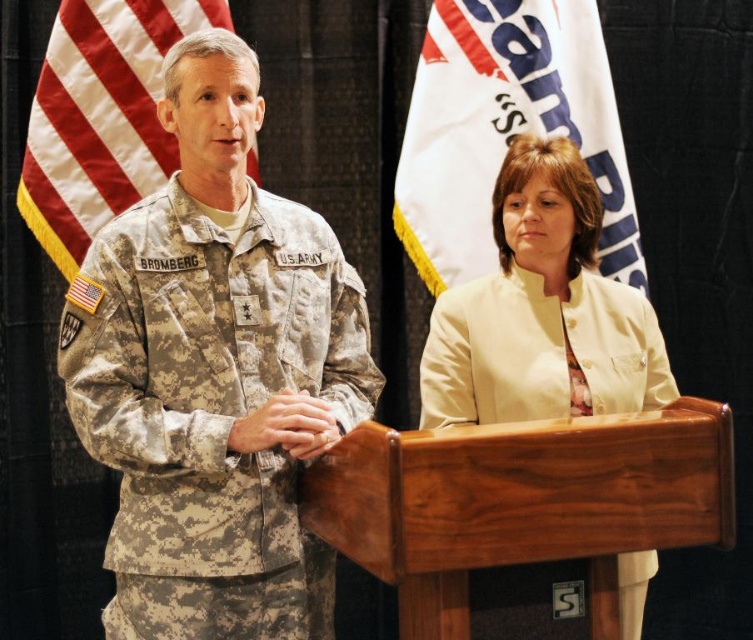
You are standing 6 feet away from the wooden podium at center. If you take one step forward, will you be closer to the podium?

The wooden podium at center is currently 5.19 feet away from you. If you move 1 foot closer, you will be 4.19 feet away, so yes, you will be closer to the wooden podium at center.

You are attending a military ceremony and see the wooden podium at center and the camouflage fabric flag at left. Which object is positioned to the left of the other?

The camouflage fabric flag at left is to the left of the wooden podium at center.